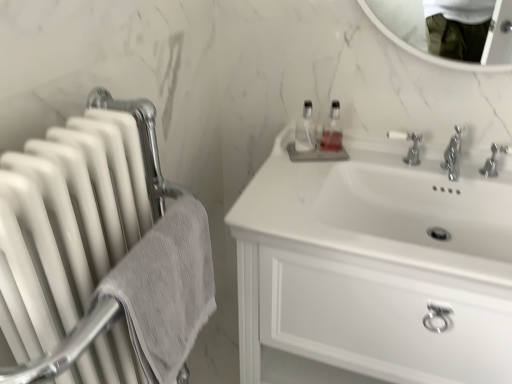
Identify the location of clear glass bottle at center. This screenshot has width=512, height=384. (305, 130).

What do you see at coordinates (79, 244) in the screenshot? The image size is (512, 384). I see `white glossy radiator at left` at bounding box center [79, 244].

Locate an element on the screen. Image resolution: width=512 pixels, height=384 pixels. white glossy radiator at left is located at coordinates (79, 244).

Where is `clear glass bottle at center`? clear glass bottle at center is located at coordinates (305, 130).

Does point (147, 298) appear closer or farther from the camera than point (296, 139)?

Point (147, 298).

Could you tell me if gray textured towel at left is facing clear glass bottle at center?

No, gray textured towel at left is not aimed at clear glass bottle at center.

Considering the sizes of gray textured towel at left and clear glass bottle at center in the image, is gray textured towel at left bigger or smaller than clear glass bottle at center?

In the image, gray textured towel at left appears to be larger than clear glass bottle at center.

From the image's perspective, is gray textured towel at left below clear glass bottle at center?

Correct, gray textured towel at left appears lower than clear glass bottle at center in the image.

From the picture: Is white glossy cabinet at upper right facing away from clear glass bottle at center?

No, white glossy cabinet at upper right is not facing away from clear glass bottle at center.

Considering the sizes of objects white glossy cabinet at upper right and clear glass bottle at center in the image provided, who is bigger, white glossy cabinet at upper right or clear glass bottle at center?

With larger size is white glossy cabinet at upper right.

Is white glossy cabinet at upper right with clear glass bottle at center?

They are not placed beside each other.

Measure the distance between white glossy cabinet at upper right and clear glass bottle at center.

white glossy cabinet at upper right and clear glass bottle at center are 16.25 inches apart from each other.

From the image's perspective, is white glossy radiator at left below gray textured towel at left?

Correct, white glossy radiator at left appears lower than gray textured towel at left in the image.

Considering the relative sizes of white glossy radiator at left and gray textured towel at left in the image provided, is white glossy radiator at left taller than gray textured towel at left?

Yes.

From a real-world perspective, is white glossy radiator at left beneath gray textured towel at left?

Correct, in the physical world, white glossy radiator at left is lower than gray textured towel at left.

Is white glossy radiator at left further to camera compared to gray textured towel at left?

No, white glossy radiator at left is in front of gray textured towel at left.

Based on the photo, does translucent plastic soap dispenser at upper center have a smaller size compared to gray textured towel at left?

Correct, translucent plastic soap dispenser at upper center occupies less space than gray textured towel at left.

Are translucent plastic soap dispenser at upper center and gray textured towel at left far apart?

No, translucent plastic soap dispenser at upper center is in close proximity to gray textured towel at left.

Is translucent plastic soap dispenser at upper center at the left side of gray textured towel at left?

Incorrect, translucent plastic soap dispenser at upper center is not on the left side of gray textured towel at left.

Find the location of a particular element. soap dispenser located behind the gray textured towel at left is located at coordinates (332, 130).

Is silver metallic tap at upper center, marked as the second tap in a right-to-left arrangement, further to camera compared to translucent plastic soap dispenser at upper center?

No, silver metallic tap at upper center, marked as the second tap in a right-to-left arrangement, is closer to the viewer.

Which of these two, silver metallic tap at upper center, marked as the second tap in a right-to-left arrangement, or translucent plastic soap dispenser at upper center, is smaller?

translucent plastic soap dispenser at upper center is smaller.

Can you tell me how much silver metallic tap at upper center, which ranks as the 1th tap in left-to-right order, and translucent plastic soap dispenser at upper center differ in facing direction?

The angular difference between silver metallic tap at upper center, which ranks as the 1th tap in left-to-right order, and translucent plastic soap dispenser at upper center is 24.2 degrees.

From their relative heights in the image, would you say silver metallic tap at upper center, marked as the second tap in a right-to-left arrangement, is taller or shorter than translucent plastic soap dispenser at upper center?

In the image, silver metallic tap at upper center, marked as the second tap in a right-to-left arrangement, appears to be shorter than translucent plastic soap dispenser at upper center.

Is clear glass bottle at center to the left or to the right of polished chrome faucet at center right, which ranks as the second tap in left-to-right order, in the image?

Clearly, clear glass bottle at center is on the left of polished chrome faucet at center right, which ranks as the second tap in left-to-right order, in the image.

Based on the photo, is polished chrome faucet at center right, the first tap viewed from the right, located within clear glass bottle at center?

No, polished chrome faucet at center right, the first tap viewed from the right, is not inside clear glass bottle at center.

From the image's perspective, which is above, clear glass bottle at center or polished chrome faucet at center right, the first tap viewed from the right?

From the image's view, clear glass bottle at center is above.

Considering the positions of points (304, 112) and (483, 172), is point (304, 112) closer to camera compared to point (483, 172)?

No, it is behind (483, 172).

Is white glossy cabinet at upper right at the back of gray textured towel at left?

No, gray textured towel at left's orientation is not away from white glossy cabinet at upper right.

Is point (142, 366) closer or farther from the camera than point (384, 319)?

Point (142, 366) is closer to the camera than point (384, 319).

Which object is further away from the camera taking this photo, gray textured towel at left or white glossy cabinet at upper right?

white glossy cabinet at upper right.

At what (x,y) coordinates should I click in order to perform the action: click on bottle on the right of gray textured towel at left. Please return your answer as a coordinate pair (x, y). Looking at the image, I should click on (305, 130).

I want to click on bathroom cabinet in front of the clear glass bottle at center, so click(x=376, y=264).

When comparing their distances from silver metallic tap at upper center, which ranks as the 1th tap in left-to-right order, does gray textured towel at left or white glossy radiator at left seem closer?

Based on the image, gray textured towel at left appears to be nearer to silver metallic tap at upper center, which ranks as the 1th tap in left-to-right order.

Considering their positions, is clear glass bottle at center positioned closer to polished chrome faucet at center right, which ranks as the second tap in left-to-right order, than gray textured towel at left?

Based on the image, clear glass bottle at center appears to be nearer to polished chrome faucet at center right, which ranks as the second tap in left-to-right order.

Considering their positions, is white glossy cabinet at upper right positioned further to silver metallic tap at upper center, marked as the second tap in a right-to-left arrangement, than polished chrome faucet at center right, the first tap viewed from the right?

Based on the image, white glossy cabinet at upper right appears to be further to silver metallic tap at upper center, marked as the second tap in a right-to-left arrangement.

Looking at the image, which one is located closer to gray textured towel at left, translucent plastic soap dispenser at upper center or clear glass bottle at center?

clear glass bottle at center is positioned closer to the anchor gray textured towel at left.

Which object lies further to the anchor point translucent plastic soap dispenser at upper center, silver metallic tap at upper center, which ranks as the 1th tap in left-to-right order, or gray textured towel at left?

gray textured towel at left is further to translucent plastic soap dispenser at upper center.

Looking at the image, which one is located closer to polished chrome faucet at center right, the first tap viewed from the right, silver metallic tap at upper center, which ranks as the 1th tap in left-to-right order, or white glossy cabinet at upper right?

Based on the image, silver metallic tap at upper center, which ranks as the 1th tap in left-to-right order, appears to be nearer to polished chrome faucet at center right, the first tap viewed from the right.

Looking at the image, which one is located further to clear glass bottle at center, white glossy radiator at left or gray textured towel at left?

The object further to clear glass bottle at center is white glossy radiator at left.

From the image, which object appears to be nearer to white glossy radiator at left, gray textured towel at left or polished chrome faucet at center right, which ranks as the second tap in left-to-right order?

gray textured towel at left is positioned closer to the anchor white glossy radiator at left.

Locate an element on the screen. The height and width of the screenshot is (384, 512). tap situated between white glossy radiator at left and polished chrome faucet at center right, which ranks as the second tap in left-to-right order, from left to right is located at coordinates (410, 147).

Identify the location of bathroom cabinet located between gray textured towel at left and polished chrome faucet at center right, which ranks as the second tap in left-to-right order, in the left-right direction. The width and height of the screenshot is (512, 384). (376, 264).

Find the location of a particular element. Image resolution: width=512 pixels, height=384 pixels. bathroom cabinet located between white glossy radiator at left and polished chrome faucet at center right, which ranks as the second tap in left-to-right order, in the left-right direction is located at coordinates (376, 264).

Identify the location of bottle located between gray textured towel at left and translucent plastic soap dispenser at upper center in the depth direction. Image resolution: width=512 pixels, height=384 pixels. (305, 130).